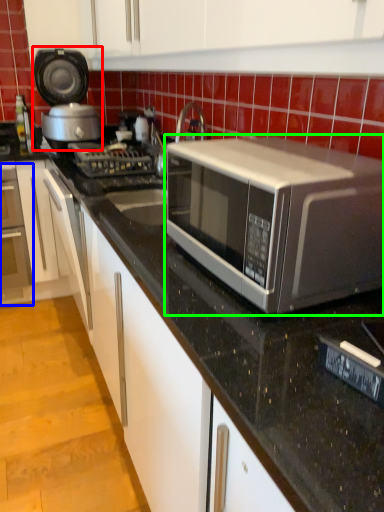
Question: Which is farther away from appliance (highlighted by a red box)? oven (highlighted by a blue box) or microwave oven (highlighted by a green box)?

Choices:
 (A) oven
 (B) microwave oven

Answer: (B)